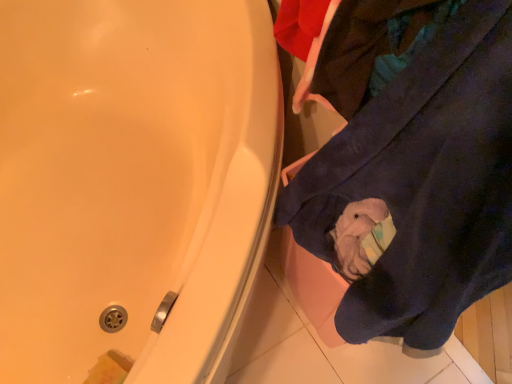
What is the approximate height of matte white bathtub at upper left?

The height of matte white bathtub at upper left is 24.76 inches.

You are a GUI agent. You are given a task and a screenshot of the screen. Output one action in this format:
    pyautogui.click(x=<x>, y=<y>)
    Task: Click on the matte white bathtub at upper left
    The height and width of the screenshot is (384, 512).
    Given the screenshot: What is the action you would take?
    pyautogui.click(x=133, y=184)

The image size is (512, 384). Describe the element at coordinates (133, 184) in the screenshot. I see `matte white bathtub at upper left` at that location.

What do you see at coordinates (410, 163) in the screenshot? I see `navy blue towel at lower right` at bounding box center [410, 163].

The image size is (512, 384). I want to click on navy blue towel at lower right, so click(410, 163).

Image resolution: width=512 pixels, height=384 pixels. Find the location of `matte white bathtub at upper left`. matte white bathtub at upper left is located at coordinates (133, 184).

In the image, is matte white bathtub at upper left on the left side or the right side of navy blue towel at lower right?

In the image, matte white bathtub at upper left appears on the left side of navy blue towel at lower right.

Is matte white bathtub at upper left positioned behind navy blue towel at lower right?

Yes, matte white bathtub at upper left is further from the viewer.

Is point (189, 127) farther from camera compared to point (416, 138)?

Yes, it is.

From the image's perspective, which is below, matte white bathtub at upper left or navy blue towel at lower right?

navy blue towel at lower right, from the image's perspective.

From a real-world perspective, is matte white bathtub at upper left under navy blue towel at lower right?

Correct, in the physical world, matte white bathtub at upper left is lower than navy blue towel at lower right.

Which of these two, matte white bathtub at upper left or navy blue towel at lower right, is thinner?

navy blue towel at lower right is thinner.

Considering the relative sizes of matte white bathtub at upper left and navy blue towel at lower right in the image provided, is matte white bathtub at upper left shorter than navy blue towel at lower right?

Yes, matte white bathtub at upper left is shorter than navy blue towel at lower right.

Which of these two, matte white bathtub at upper left or navy blue towel at lower right, is smaller?

navy blue towel at lower right is smaller.

Is matte white bathtub at upper left located outside navy blue towel at lower right?

Indeed, matte white bathtub at upper left is completely outside navy blue towel at lower right.

Is matte white bathtub at upper left far from navy blue towel at lower right?

No, matte white bathtub at upper left is not far away from navy blue towel at lower right.

Could you tell me if matte white bathtub at upper left is facing navy blue towel at lower right?

No, matte white bathtub at upper left does not turn towards navy blue towel at lower right.

How many degrees apart are the facing directions of matte white bathtub at upper left and navy blue towel at lower right?

The angular difference between matte white bathtub at upper left and navy blue towel at lower right is 87.3 degrees.

How distant is matte white bathtub at upper left from navy blue towel at lower right?

matte white bathtub at upper left and navy blue towel at lower right are 15.90 inches apart from each other.

Image resolution: width=512 pixels, height=384 pixels. In order to click on bathtub located on the left of navy blue towel at lower right in this screenshot , I will do `click(133, 184)`.

Which is more to the left, navy blue towel at lower right or matte white bathtub at upper left?

matte white bathtub at upper left is more to the left.

In the image, is navy blue towel at lower right positioned in front of or behind matte white bathtub at upper left?

Visually, navy blue towel at lower right is located in front of matte white bathtub at upper left.

Which is less distant, (362, 310) or (172, 135)?

Clearly, point (362, 310) is closer to the camera than point (172, 135).

From the image's perspective, is navy blue towel at lower right under matte white bathtub at upper left?

Indeed, from the image's perspective, navy blue towel at lower right is shown beneath matte white bathtub at upper left.

From a real-world perspective, is navy blue towel at lower right over matte white bathtub at upper left?

Yes, from a real-world perspective, navy blue towel at lower right is over matte white bathtub at upper left

Can you confirm if navy blue towel at lower right is wider than matte white bathtub at upper left?

No, navy blue towel at lower right is not wider than matte white bathtub at upper left.

Between navy blue towel at lower right and matte white bathtub at upper left, which one has less height?

With less height is matte white bathtub at upper left.

Does navy blue towel at lower right have a larger size compared to matte white bathtub at upper left?

Actually, navy blue towel at lower right might be smaller than matte white bathtub at upper left.

Is navy blue towel at lower right not inside matte white bathtub at upper left?

No, navy blue towel at lower right is inside matte white bathtub at upper left's boundary.

Is navy blue towel at lower right next to matte white bathtub at upper left?

No.

Is navy blue towel at lower right looking in the opposite direction of matte white bathtub at upper left?

No, navy blue towel at lower right is not facing away from matte white bathtub at upper left.

In the scene shown: How different are the orientations of navy blue towel at lower right and matte white bathtub at upper left in degrees?

There is a 87.3-degree angle between the facing directions of navy blue towel at lower right and matte white bathtub at upper left.

Find the location of a particular element. This screenshot has height=384, width=512. clothing below the matte white bathtub at upper left (from the image's perspective) is located at coordinates (410, 163).

The image size is (512, 384). Identify the location of clothing that is in front of the matte white bathtub at upper left. (410, 163).

Find the location of a particular element. clothing that appears below the matte white bathtub at upper left (from the image's perspective) is located at coordinates (410, 163).